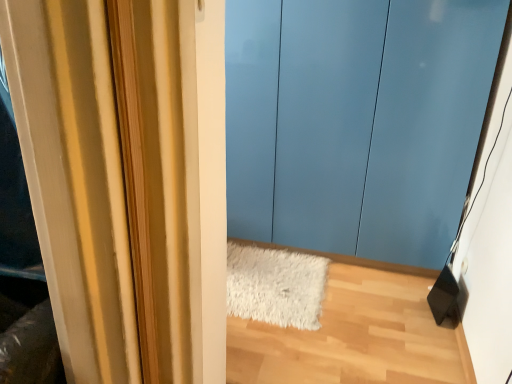
You are a GUI agent. You are given a task and a screenshot of the screen. Output one action in this format:
    pyautogui.click(x=<x>, y=<y>)
    Task: Click on the white shaggy rug at lower center
    The height and width of the screenshot is (384, 512).
    Given the screenshot: What is the action you would take?
    pyautogui.click(x=275, y=286)

What do you see at coordinates (275, 286) in the screenshot? I see `white shaggy rug at lower center` at bounding box center [275, 286].

You are a GUI agent. You are given a task and a screenshot of the screen. Output one action in this format:
    pyautogui.click(x=<x>, y=<y>)
    Task: Click on the glossy blue door at center
    
    Given the screenshot: What is the action you would take?
    pyautogui.click(x=356, y=121)

What do you see at coordinates (356, 121) in the screenshot? I see `glossy blue door at center` at bounding box center [356, 121].

The image size is (512, 384). Find the location of `white shaggy rug at lower center`. white shaggy rug at lower center is located at coordinates (275, 286).

Consider the image. Between white shaggy rug at lower center and glossy blue door at center, which one appears on the left side from the viewer's perspective?

From the viewer's perspective, white shaggy rug at lower center appears more on the left side.

Is white shaggy rug at lower center in front of or behind glossy blue door at center in the image?

Visually, white shaggy rug at lower center is located behind glossy blue door at center.

Which is closer, [262,304] or [306,153]?

Point [262,304].

From the image's perspective, between white shaggy rug at lower center and glossy blue door at center, which one is located above?

glossy blue door at center.

Consider the image. From a real-world perspective, is white shaggy rug at lower center positioned above or below glossy blue door at center?

white shaggy rug at lower center is below glossy blue door at center.

Considering the sizes of objects white shaggy rug at lower center and glossy blue door at center in the image provided, who is wider, white shaggy rug at lower center or glossy blue door at center?

Wider between the two is white shaggy rug at lower center.

Can you confirm if white shaggy rug at lower center is taller than glossy blue door at center?

No.

Who is smaller, white shaggy rug at lower center or glossy blue door at center?

white shaggy rug at lower center.

Can glossy blue door at center be found inside white shaggy rug at lower center?

That's incorrect, glossy blue door at center is not inside white shaggy rug at lower center.

Are white shaggy rug at lower center and glossy blue door at center beside each other?

white shaggy rug at lower center and glossy blue door at center are clearly separated.

Is white shaggy rug at lower center facing towards glossy blue door at center?

No.

How much distance is there between white shaggy rug at lower center and glossy blue door at center?

white shaggy rug at lower center is 25.03 inches away from glossy blue door at center.

Where is `door positioned vertically above the white shaggy rug at lower center (from a real-world perspective)`? The height and width of the screenshot is (384, 512). door positioned vertically above the white shaggy rug at lower center (from a real-world perspective) is located at coordinates (356, 121).

Considering the positions of objects glossy blue door at center and white shaggy rug at lower center in the image provided, who is more to the right, glossy blue door at center or white shaggy rug at lower center?

glossy blue door at center.

Which object is closer to the camera taking this photo, glossy blue door at center or white shaggy rug at lower center?

Positioned in front is glossy blue door at center.

Is point (252, 37) closer or farther from the camera than point (304, 260)?

Point (252, 37).

From the image's perspective, is glossy blue door at center above or below white shaggy rug at lower center?

Based on their image positions, glossy blue door at center is located above white shaggy rug at lower center.

From a real-world perspective, which is physically above, glossy blue door at center or white shaggy rug at lower center?

glossy blue door at center, from a real-world perspective.

Considering the sizes of glossy blue door at center and white shaggy rug at lower center in the image, is glossy blue door at center wider or thinner than white shaggy rug at lower center?

Clearly, glossy blue door at center has less width compared to white shaggy rug at lower center.

Can you confirm if glossy blue door at center is taller than white shaggy rug at lower center?

Correct, glossy blue door at center is much taller as white shaggy rug at lower center.

Which of these two, glossy blue door at center or white shaggy rug at lower center, is smaller?

white shaggy rug at lower center is smaller.

Is white shaggy rug at lower center completely or partially inside glossy blue door at center?

No, white shaggy rug at lower center is not inside glossy blue door at center.

Is glossy blue door at center placed right next to white shaggy rug at lower center?

They are not placed beside each other.

Is glossy blue door at center looking in the opposite direction of white shaggy rug at lower center?

No, glossy blue door at center's orientation is not away from white shaggy rug at lower center.

Locate an element on the screen. door located on the right of white shaggy rug at lower center is located at coordinates (356, 121).

The height and width of the screenshot is (384, 512). In order to click on door above the white shaggy rug at lower center (from the image's perspective) in this screenshot , I will do tap(356, 121).

Identify the location of door that appears in front of the white shaggy rug at lower center. This screenshot has height=384, width=512. (356, 121).